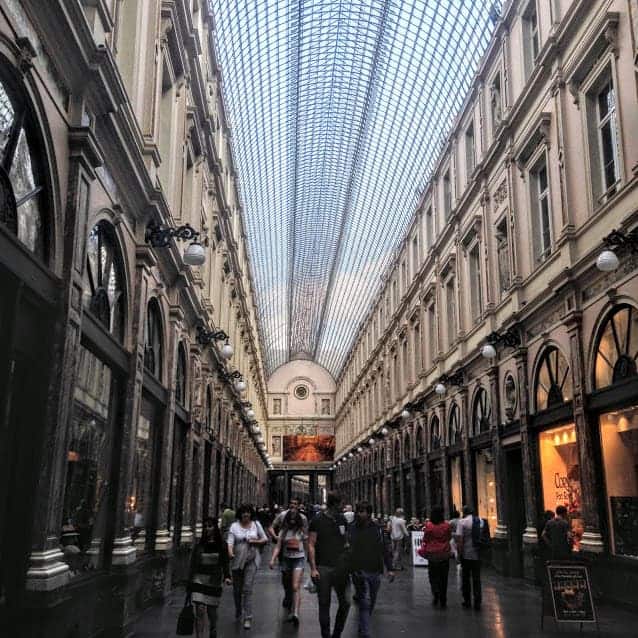
I want to click on light, so [x=189, y=249].